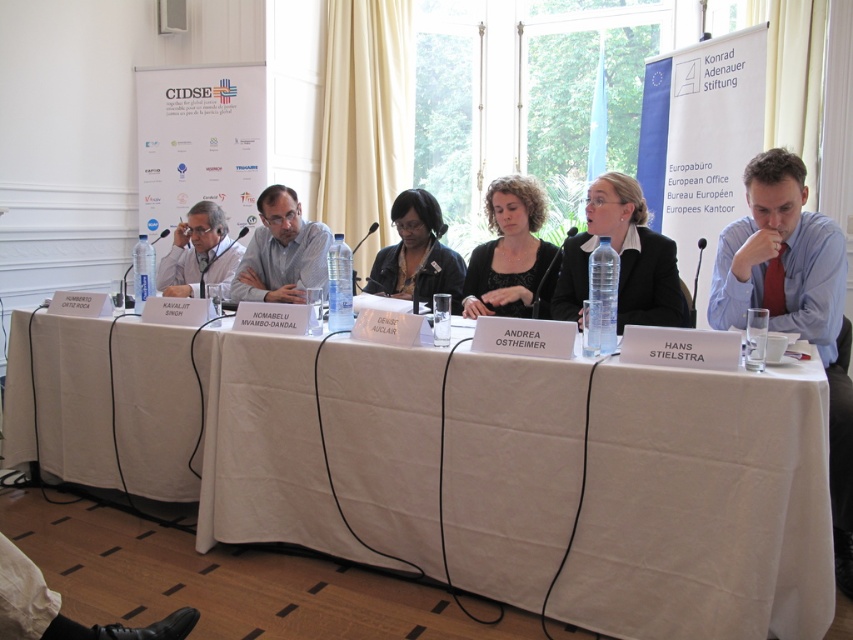
Question: From the image, what is the correct spatial relationship of white fabric table at center in relation to black matte shirt at center?

Choices:
 (A) below
 (B) above

Answer: (A)

Question: Which point appears closest to the camera in this image?

Choices:
 (A) (498, 227)
 (B) (374, 264)
 (C) (643, 308)

Answer: (C)

Question: Which point is closer to the camera taking this photo?

Choices:
 (A) (173, 275)
 (B) (71, 476)

Answer: (B)

Question: Is black glossy suit at center wider than black matte shirt at center?

Choices:
 (A) no
 (B) yes

Answer: (B)

Question: From the image, what is the correct spatial relationship of blue shirt at right in relation to matte gray suit at left?

Choices:
 (A) right
 (B) left

Answer: (A)

Question: Based on their relative distances, which object is nearer to the gray striped shirt at center?

Choices:
 (A) matte gray suit at left
 (B) black glossy suit at center
 (C) matte black jacket at center
 (D) white fabric table at center

Answer: (A)